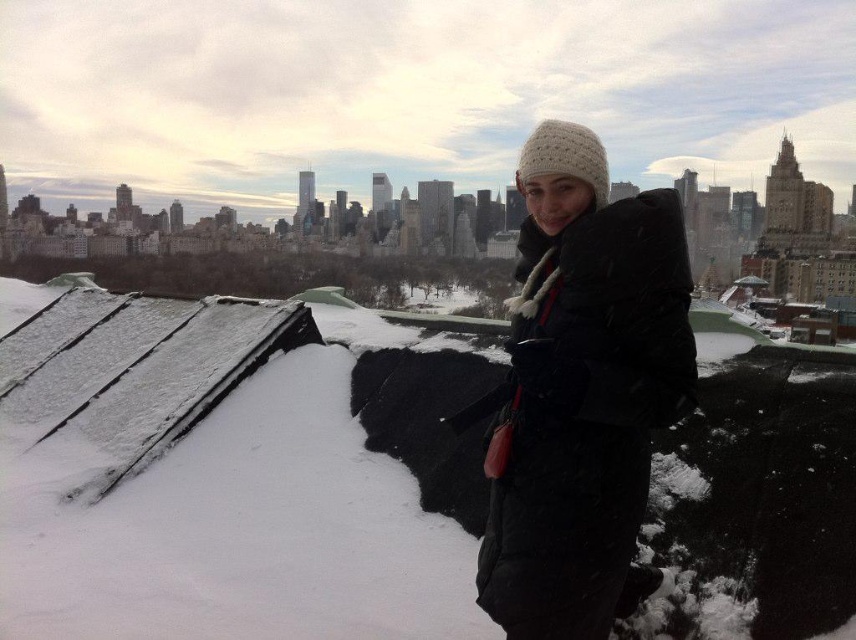
Question: Does white fluffy snow at center lie in front of matte black coat at center?

Choices:
 (A) no
 (B) yes

Answer: (A)

Question: Does white fluffy snow at center appear on the right side of matte black coat at center?

Choices:
 (A) yes
 (B) no

Answer: (B)

Question: Which object is closer to the camera taking this photo?

Choices:
 (A) matte black coat at center
 (B) white fluffy snow at center

Answer: (A)

Question: Can you confirm if white fluffy snow at center is wider than matte black coat at center?

Choices:
 (A) no
 (B) yes

Answer: (B)

Question: Which point appears closest to the camera in this image?

Choices:
 (A) (587, 310)
 (B) (191, 397)

Answer: (A)